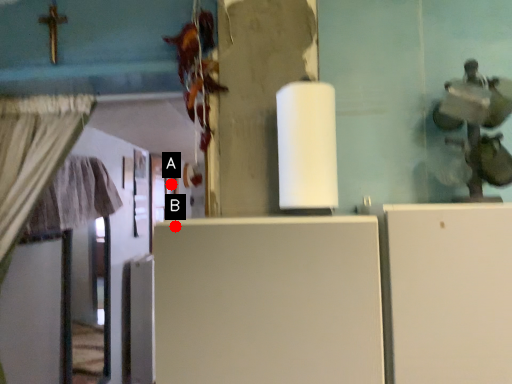
Question: Two points are circled on the image, labeled by A and B beside each circle. Which point is closer to the camera?

Choices:
 (A) A is closer
 (B) B is closer

Answer: (B)